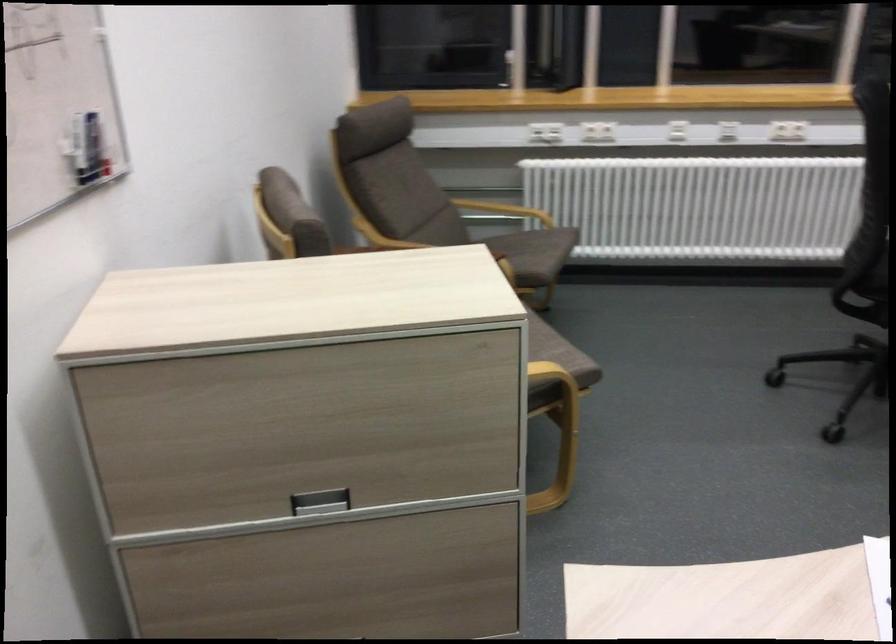
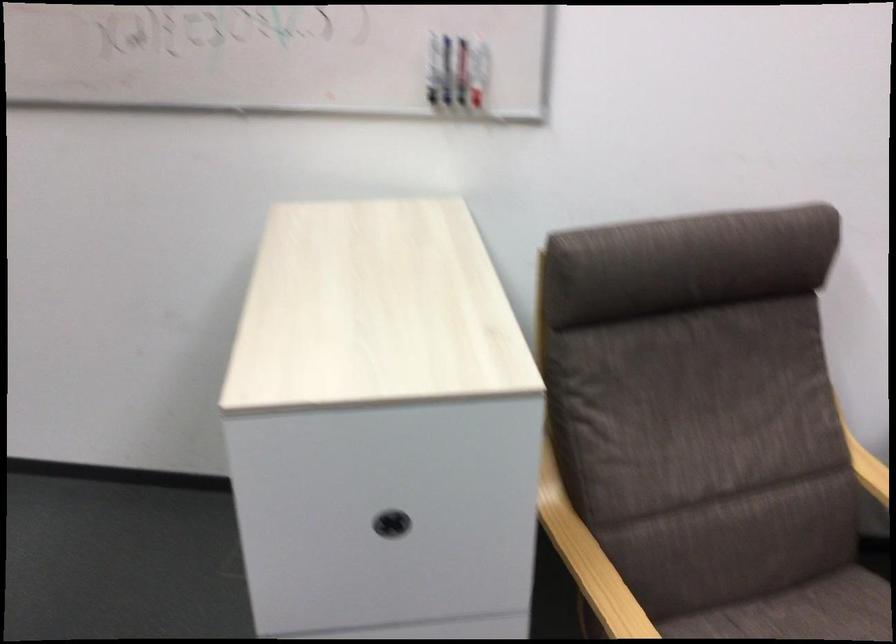
Find the pixel in the second image that matches point (498, 364) in the first image.

(391, 524)